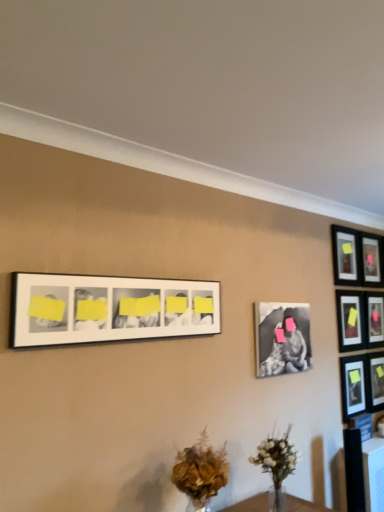
Where is `pink matte picture frame at upper right, the second picture frame positioned from the right`? The width and height of the screenshot is (384, 512). pink matte picture frame at upper right, the second picture frame positioned from the right is located at coordinates (375, 318).

Describe the element at coordinates (357, 257) in the screenshot. This screenshot has width=384, height=512. I see `matte black picture frame at upper right, the sixth picture frame positioned from the right` at that location.

Measure the distance between matte black picture frame at upper right, placed as the third picture frame when sorted from left to right, and camera.

matte black picture frame at upper right, placed as the third picture frame when sorted from left to right, is 10.08 feet from camera.

You are a GUI agent. You are given a task and a screenshot of the screen. Output one action in this format:
    pyautogui.click(x=<x>, y=<y>)
    Task: Click on the matte black picture frame at upper right, the 1th picture frame positioned from the right
    
    Given the screenshot: What is the action you would take?
    pyautogui.click(x=376, y=381)

What do you see at coordinates (372, 260) in the screenshot?
I see `matte black picture frame at upper right, which ranks as the third picture frame in right-to-left order` at bounding box center [372, 260].

Locate an element on the screen. white matte picture frame at upper center, which is the 1th picture frame in left-to-right order is located at coordinates (108, 309).

You are a GUI agent. You are given a task and a screenshot of the screen. Output one action in this format:
    pyautogui.click(x=<x>, y=<y>)
    Task: Click on the pink matte picture frame at upper right, which is counted as the seventh picture frame, starting from the left
    
    Given the screenshot: What is the action you would take?
    pyautogui.click(x=375, y=318)

Is pink matte picture frame at upper right, the second picture frame positioned from the right, positioned with its back to matte black picture frame at upper right, which is counted as the 8th picture frame, starting from the left?

That's not correct — pink matte picture frame at upper right, the second picture frame positioned from the right, is not looking away from matte black picture frame at upper right, which is counted as the 8th picture frame, starting from the left.

Which object is more forward, pink matte picture frame at upper right, the second picture frame positioned from the right, or matte black picture frame at upper right, which is counted as the 8th picture frame, starting from the left?

matte black picture frame at upper right, which is counted as the 8th picture frame, starting from the left, is in front.

Can you confirm if pink matte picture frame at upper right, which is counted as the seventh picture frame, starting from the left, is thinner than matte black picture frame at upper right, which is counted as the 8th picture frame, starting from the left?

In fact, pink matte picture frame at upper right, which is counted as the seventh picture frame, starting from the left, might be wider than matte black picture frame at upper right, which is counted as the 8th picture frame, starting from the left.

Is matte black picture frame at upper right, the 5th picture frame when ordered from right to left, inside or outside of matte black picture frame at right, which is counted as the 5th picture frame, starting from the left?

matte black picture frame at upper right, the 5th picture frame when ordered from right to left, cannot be found inside matte black picture frame at right, which is counted as the 5th picture frame, starting from the left.

Considering the relative sizes of matte black picture frame at upper right, the 5th picture frame when ordered from right to left, and matte black picture frame at right, the fourth picture frame positioned from the right, in the image provided, is matte black picture frame at upper right, the 5th picture frame when ordered from right to left, thinner than matte black picture frame at right, the fourth picture frame positioned from the right,?

No, matte black picture frame at upper right, the 5th picture frame when ordered from right to left, is not thinner than matte black picture frame at right, the fourth picture frame positioned from the right.

From a real-world perspective, is matte black picture frame at upper right, the 5th picture frame when ordered from right to left, above or below matte black picture frame at right, the fourth picture frame positioned from the right?

From a real-world perspective, matte black picture frame at upper right, the 5th picture frame when ordered from right to left, is physically above matte black picture frame at right, the fourth picture frame positioned from the right.

From a real-world perspective, starting from the white matte vase at lower center, which picture frame is the 4th one vertically above it? Please provide its 2D coordinates.

[(350, 320)]

From the image's perspective, between white matte vase at lower center and matte black picture frame at upper right, the fourth picture frame in the left-to-right sequence, which one is located above?

matte black picture frame at upper right, the fourth picture frame in the left-to-right sequence.

Is white matte vase at lower center positioned far away from matte black picture frame at upper right, the 5th picture frame when ordered from right to left?

Indeed, white matte vase at lower center is not near matte black picture frame at upper right, the 5th picture frame when ordered from right to left.

Between brown textured bouquet at lower center and matte black picture frame at upper right, the sixth picture frame positioned from the right, which one appears on the left side from the viewer's perspective?

brown textured bouquet at lower center is more to the left.

Is the position of brown textured bouquet at lower center more distant than that of matte black picture frame at upper right, the sixth picture frame positioned from the right?

No.

Who is bigger, brown textured bouquet at lower center or matte black picture frame at upper right, the sixth picture frame positioned from the right?

brown textured bouquet at lower center is bigger.

From the image's perspective, is brown textured bouquet at lower center on top of matte black picture frame at upper right, placed as the third picture frame when sorted from left to right?

No, from the image's perspective, brown textured bouquet at lower center is not on top of matte black picture frame at upper right, placed as the third picture frame when sorted from left to right.

Considering the sizes of objects matte black picture frame at upper right, placed as the third picture frame when sorted from left to right, and matte black picture frame at upper right, which is counted as the 8th picture frame, starting from the left, in the image provided, who is shorter, matte black picture frame at upper right, placed as the third picture frame when sorted from left to right, or matte black picture frame at upper right, which is counted as the 8th picture frame, starting from the left,?

matte black picture frame at upper right, placed as the third picture frame when sorted from left to right.

Does matte black picture frame at upper right, the sixth picture frame positioned from the right, touch matte black picture frame at upper right, which is counted as the 8th picture frame, starting from the left?

No, matte black picture frame at upper right, the sixth picture frame positioned from the right, is not beside matte black picture frame at upper right, which is counted as the 8th picture frame, starting from the left.

Considering the relative positions of matte black picture frame at upper right, placed as the third picture frame when sorted from left to right, and matte black picture frame at upper right, which is counted as the 8th picture frame, starting from the left, in the image provided, is matte black picture frame at upper right, placed as the third picture frame when sorted from left to right, behind matte black picture frame at upper right, which is counted as the 8th picture frame, starting from the left,?

No, it is not.

Can white matte vase at lower center be found inside matte black picture frame at upper right, the 5th picture frame when ordered from right to left?

No, white matte vase at lower center is located outside of matte black picture frame at upper right, the 5th picture frame when ordered from right to left.

In terms of width, does matte black picture frame at upper right, the 5th picture frame when ordered from right to left, look wider or thinner when compared to white matte vase at lower center?

matte black picture frame at upper right, the 5th picture frame when ordered from right to left, is thinner than white matte vase at lower center.

Is matte black picture frame at upper right, the fourth picture frame in the left-to-right sequence, further to the viewer compared to white matte vase at lower center?

Yes, matte black picture frame at upper right, the fourth picture frame in the left-to-right sequence, is further from the camera.

Is matte black picture frame at upper right, the fourth picture frame in the left-to-right sequence, looking in the opposite direction of white matte vase at lower center?

No.

From the image's perspective, who appears lower, matte black picture frame at upper right, the 5th picture frame when ordered from right to left, or black matte photo frame at center-right, which ranks as the second picture frame in left-to-right order?

black matte photo frame at center-right, which ranks as the second picture frame in left-to-right order, is shown below in the image.

Between matte black picture frame at upper right, the 5th picture frame when ordered from right to left, and black matte photo frame at center-right, which ranks as the second picture frame in left-to-right order, which one is positioned behind?

matte black picture frame at upper right, the 5th picture frame when ordered from right to left.

Does matte black picture frame at upper right, the fourth picture frame in the left-to-right sequence, turn towards black matte photo frame at center-right, which ranks as the second picture frame in left-to-right order?

No, matte black picture frame at upper right, the fourth picture frame in the left-to-right sequence, is not aimed at black matte photo frame at center-right, which ranks as the second picture frame in left-to-right order.

Which of these two, matte black picture frame at upper right, the fourth picture frame in the left-to-right sequence, or black matte photo frame at center-right, the 7th picture frame when ordered from right to left, is wider?

matte black picture frame at upper right, the fourth picture frame in the left-to-right sequence.

Locate an element on the screen. The width and height of the screenshot is (384, 512). picture frame on the right of pink matte picture frame at upper right, the second picture frame positioned from the right is located at coordinates (376, 381).

There is a matte black picture frame at upper right, the fourth picture frame in the left-to-right sequence. Identify the location of the 3rd picture frame below it (from a real-world perspective). The image size is (384, 512). (353, 386).

When comparing their distances from matte black picture frame at upper right, the 5th picture frame when ordered from right to left, does black matte photo frame at center-right, the 7th picture frame when ordered from right to left, or matte black picture frame at upper right, the 6th picture frame when ordered from left to right, seem further?

black matte photo frame at center-right, the 7th picture frame when ordered from right to left, lies further to matte black picture frame at upper right, the 5th picture frame when ordered from right to left, than the other object.

When comparing their distances from matte black picture frame at upper right, the 6th picture frame when ordered from left to right, does brown textured bouquet at lower center or black matte photo frame at center-right, the 7th picture frame when ordered from right to left, seem further?

brown textured bouquet at lower center is positioned further to the anchor matte black picture frame at upper right, the 6th picture frame when ordered from left to right.

Looking at the image, which one is located closer to white matte picture frame at upper center, which is the 1th picture frame in left-to-right order, matte black picture frame at upper right, which is counted as the 8th picture frame, starting from the left, or brown textured bouquet at lower center?

Among the two, brown textured bouquet at lower center is located nearer to white matte picture frame at upper center, which is the 1th picture frame in left-to-right order.

Considering their positions, is matte black picture frame at right, which is counted as the 5th picture frame, starting from the left, positioned further to matte black picture frame at upper right, the sixth picture frame positioned from the right, than matte black picture frame at upper right, the fourth picture frame in the left-to-right sequence?

matte black picture frame at right, which is counted as the 5th picture frame, starting from the left, is positioned further to the anchor matte black picture frame at upper right, the sixth picture frame positioned from the right.

When comparing their distances from white matte picture frame at upper center, which is the 1th picture frame in left-to-right order, does white matte vase at lower center or matte black picture frame at right, the fourth picture frame positioned from the right, seem further?

The object further to white matte picture frame at upper center, which is the 1th picture frame in left-to-right order, is matte black picture frame at right, the fourth picture frame positioned from the right.

Consider the image. Considering their positions, is pink matte picture frame at upper right, which is counted as the seventh picture frame, starting from the left, positioned closer to white matte picture frame at upper center, which is the 1th picture frame in left-to-right order, than matte black picture frame at upper right, the sixth picture frame positioned from the right?

matte black picture frame at upper right, the sixth picture frame positioned from the right.

When comparing their distances from white matte vase at lower center, does matte black picture frame at upper right, the 1th picture frame positioned from the right, or matte black picture frame at upper right, the 5th picture frame when ordered from right to left, seem further?

matte black picture frame at upper right, the 1th picture frame positioned from the right, is further to white matte vase at lower center.

Based on their spatial positions, is matte black picture frame at upper right, the 6th picture frame when ordered from left to right, or pink matte picture frame at upper right, the second picture frame positioned from the right, closer to black matte photo frame at center-right, the 7th picture frame when ordered from right to left?

pink matte picture frame at upper right, the second picture frame positioned from the right, is closer to black matte photo frame at center-right, the 7th picture frame when ordered from right to left.

In order to click on floral arrangement between white matte picture frame at upper center, the 8th picture frame viewed from the right, and pink matte picture frame at upper right, the second picture frame positioned from the right, from front to back in this screenshot , I will do `click(277, 466)`.

In order to click on flower between white matte picture frame at upper center, the 8th picture frame viewed from the right, and matte black picture frame at upper right, placed as the third picture frame when sorted from left to right, in the front-back direction in this screenshot , I will do `click(201, 470)`.

This screenshot has width=384, height=512. Identify the location of picture frame between pink matte picture frame at upper right, the second picture frame positioned from the right, and matte black picture frame at upper right, which is counted as the 8th picture frame, starting from the left, vertically. click(353, 386).

The height and width of the screenshot is (512, 384). I want to click on floral arrangement located between brown textured bouquet at lower center and matte black picture frame at upper right, the fourth picture frame in the left-to-right sequence, in the depth direction, so click(x=277, y=466).